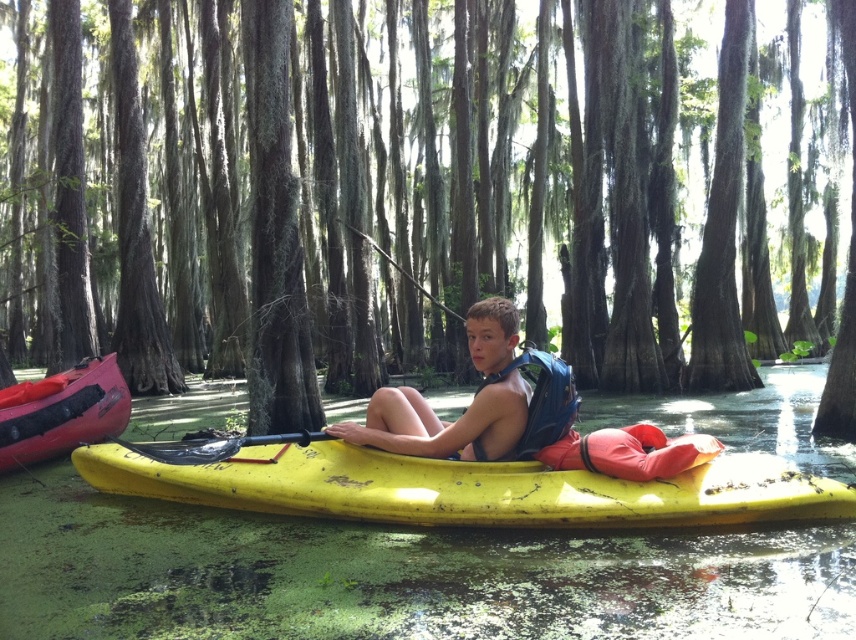
In the scene shown: Who is shorter, green algae water at center or yellow matte canoe at center?

yellow matte canoe at center

Between green algae water at center and yellow matte canoe at center, which one is positioned lower?

green algae water at center is lower down.

Image resolution: width=856 pixels, height=640 pixels. Find the location of `green algae water at center`. green algae water at center is located at coordinates (395, 573).

What do you see at coordinates (407, 195) in the screenshot? Image resolution: width=856 pixels, height=640 pixels. I see `green mossy tree at center` at bounding box center [407, 195].

Between green mossy tree at center and yellow matte canoe at center, which one has more height?

green mossy tree at center is taller.

Does point (761, 268) come farther from viewer compared to point (229, 477)?

Yes.

Locate an element on the screen. green mossy tree at center is located at coordinates (407, 195).

Which is below, green algae water at center or matte yellow kayak at center?

Positioned lower is green algae water at center.

Which is more to the right, green algae water at center or matte yellow kayak at center?

From the viewer's perspective, matte yellow kayak at center appears more on the right side.

Identify the location of green algae water at center. The height and width of the screenshot is (640, 856). (395, 573).

What are the coordinates of `green algae water at center` in the screenshot? It's located at (395, 573).